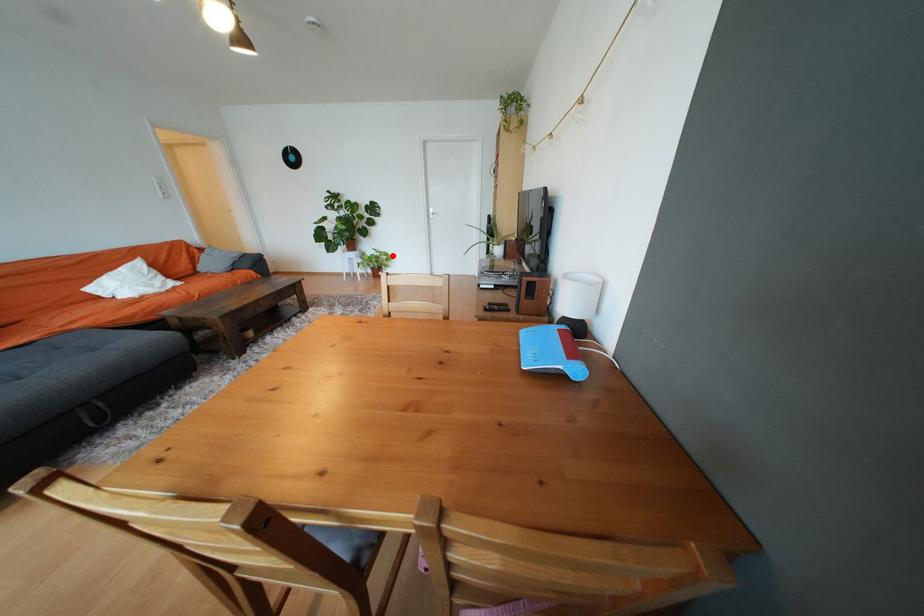
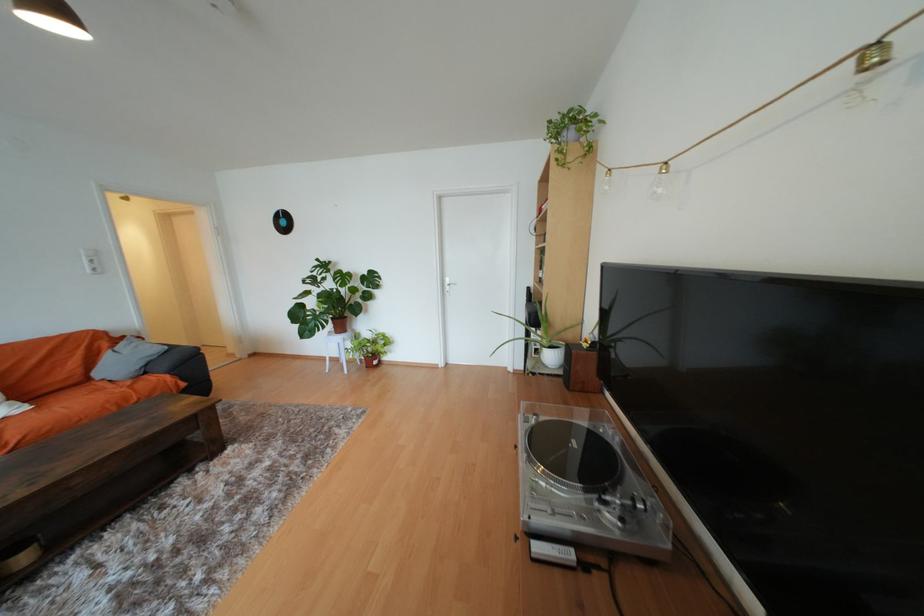
Question: I am providing you with two images of the same scene from different viewpoints. Given a red point in image1, look at the same physical point in image2. Is it:

Choices:
 (A) Closer to the viewpoint
 (B) Farther from the viewpoint

Answer: (B)